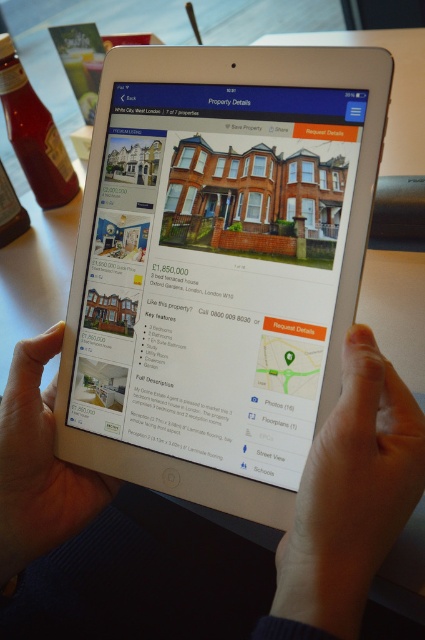
Is white matte skin at center wider than smooth skin hand at lower center?

Yes.

Between white matte skin at center and smooth skin hand at lower center, which one appears on the left side from the viewer's perspective?

white matte skin at center is more to the left.

You are a GUI agent. You are given a task and a screenshot of the screen. Output one action in this format:
    pyautogui.click(x=<x>, y=<y>)
    Task: Click on the white matte skin at center
    
    Given the screenshot: What is the action you would take?
    pyautogui.click(x=201, y=524)

Who is positioned more to the right, smooth skin hand at lower center or skinny white hand at lower center?

From the viewer's perspective, smooth skin hand at lower center appears more on the right side.

Is smooth skin hand at lower center to the right of skinny white hand at lower center from the viewer's perspective?

Correct, you'll find smooth skin hand at lower center to the right of skinny white hand at lower center.

Is point (320, 592) positioned in front of point (40, 403)?

That is True.

Where is `smooth skin hand at lower center`? smooth skin hand at lower center is located at coordinates (351, 493).

Between white plastic tablet at center and skinny white hand at lower center, which one appears on the left side from the viewer's perspective?

Positioned to the left is skinny white hand at lower center.

Between point (343, 305) and point (39, 406), which one is positioned behind?

The point (39, 406) is more distant.

Does point (70, 326) come closer to viewer compared to point (10, 461)?

No, (70, 326) is further to viewer.

Locate an element on the screen. Image resolution: width=425 pixels, height=640 pixels. white plastic tablet at center is located at coordinates (218, 266).